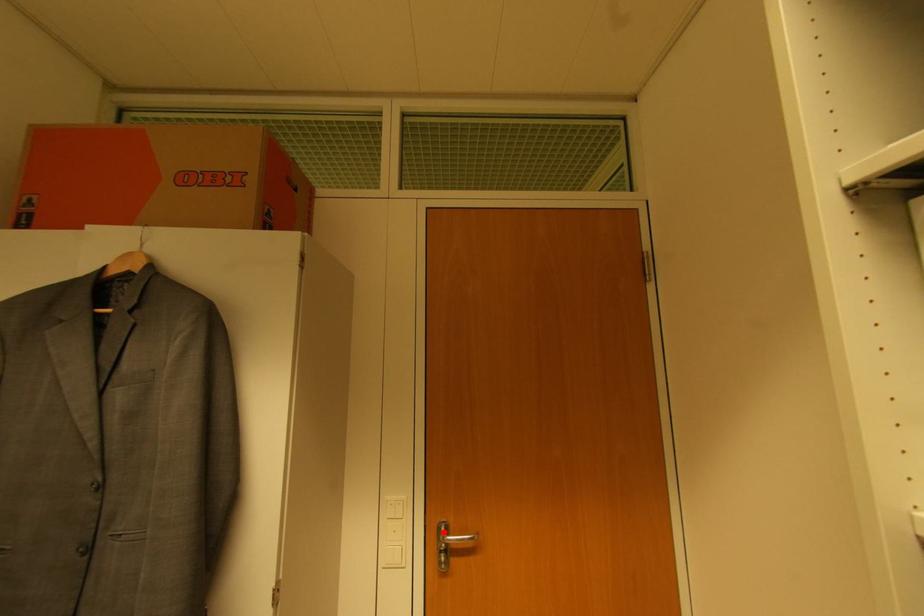
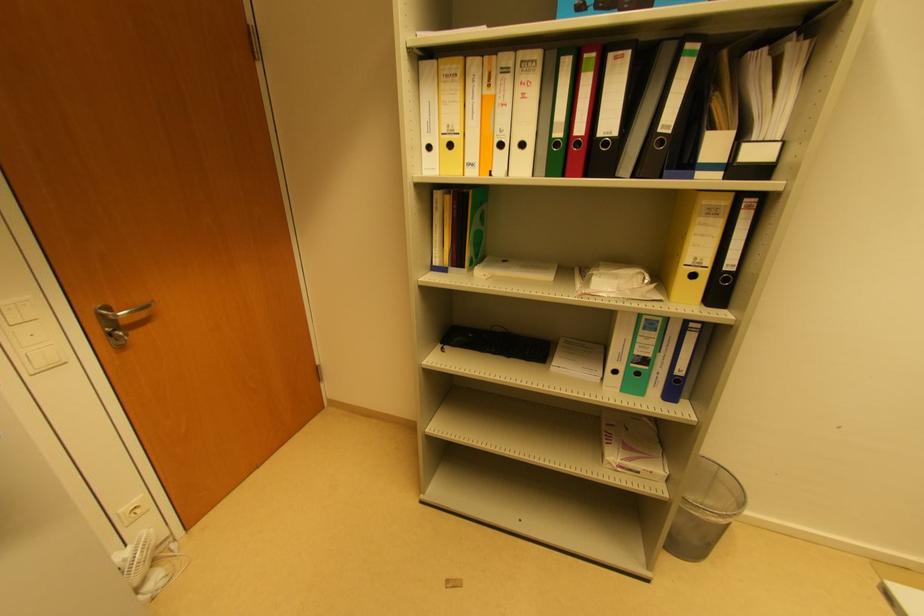
Question: I am providing you with two images of the same scene from different viewpoints. A red point is marked on the first image. At the location where the point appears in image 1, is it still visible in image 2?

Choices:
 (A) Yes
 (B) No

Answer: (A)